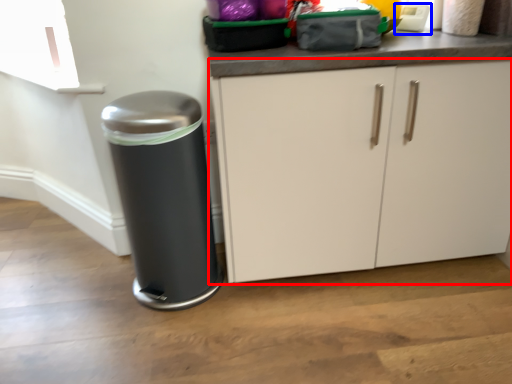
Question: Which object appears closest to the camera in this image, cabinetry (highlighted by a red box) or appliance (highlighted by a blue box)?

Choices:
 (A) cabinetry
 (B) appliance

Answer: (A)